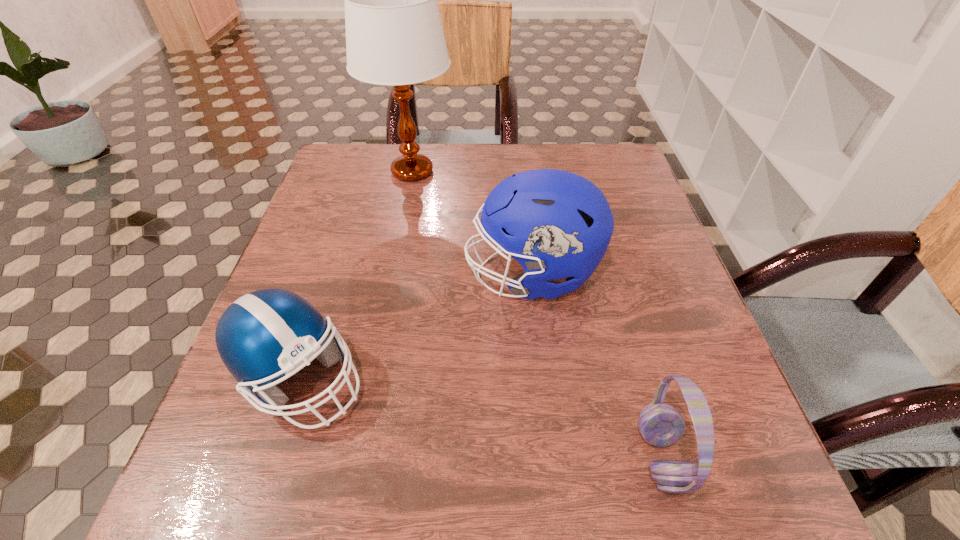
Where is `object located in the far left corner section of the desktop`? This screenshot has width=960, height=540. object located in the far left corner section of the desktop is located at coordinates (394, 36).

Find the location of `object that is at the near right corner`. object that is at the near right corner is located at coordinates (661, 425).

At what (x,y) coordinates should I click in order to perform the action: click on vacant space at the far edge. Please return your answer as a coordinate pair (x, y). The width and height of the screenshot is (960, 540). Looking at the image, I should click on (507, 178).

Where is `free region at the near edge of the desktop`? free region at the near edge of the desktop is located at coordinates (640, 484).

In order to click on vacant position at the left edge of the desktop in this screenshot , I will do `click(334, 265)`.

This screenshot has width=960, height=540. I want to click on vacant space at the right edge of the desktop, so click(x=675, y=457).

Locate an element on the screen. This screenshot has height=540, width=960. blank space at the far left corner of the desktop is located at coordinates (365, 153).

Locate an element on the screen. vacant space at the far right corner of the desktop is located at coordinates (592, 166).

This screenshot has height=540, width=960. I want to click on vacant area that lies between the third shortest object and the headset, so click(x=596, y=366).

Locate an element on the screen. vacant area between the tallest object and the second tallest object is located at coordinates (472, 223).